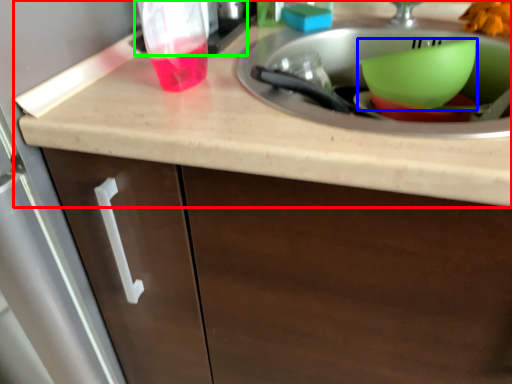
Question: Which object is positioned closest to countertop (highlighted by a red box)? Select from basin (highlighted by a blue box) and appliance (highlighted by a green box).

Choices:
 (A) basin
 (B) appliance

Answer: (B)